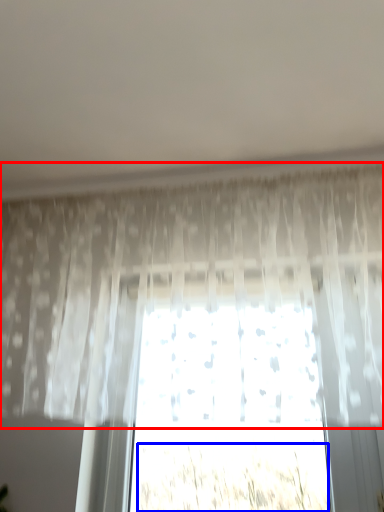
Question: Which object appears farthest to the camera in this image, curtain (highlighted by a red box) or plant (highlighted by a blue box)?

Choices:
 (A) curtain
 (B) plant

Answer: (B)